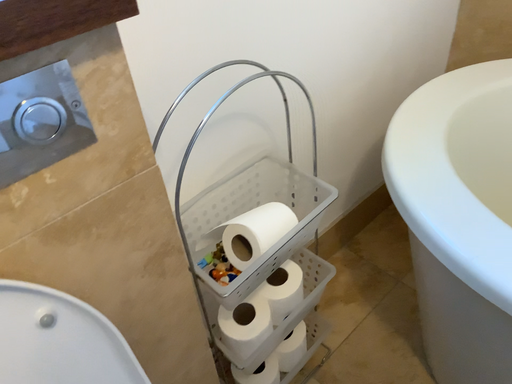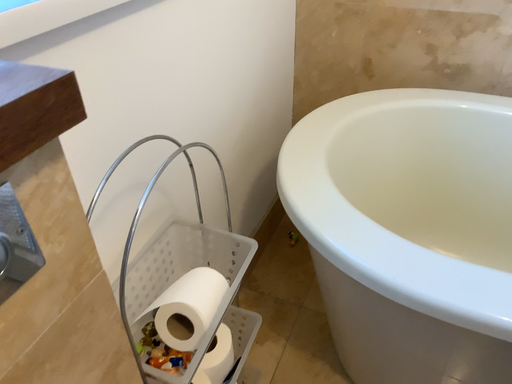
Question: How did the camera likely rotate when shooting the video?

Choices:
 (A) rotated left
 (B) rotated right

Answer: (B)